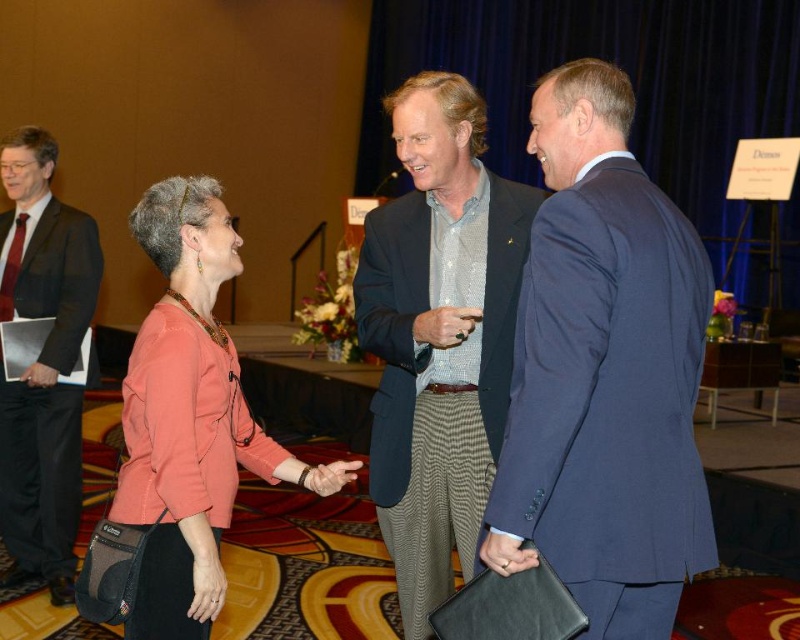
Who is positioned more to the right, textured wool blazer at center or dark gray suit at left?

From the viewer's perspective, textured wool blazer at center appears more on the right side.

I want to click on textured wool blazer at center, so click(438, 333).

The height and width of the screenshot is (640, 800). What are the coordinates of `textured wool blazer at center` in the screenshot? It's located at (438, 333).

Is blue suit at center positioned behind textured wool blazer at center?

No, it is not.

Does blue suit at center have a smaller size compared to textured wool blazer at center?

Indeed, blue suit at center has a smaller size compared to textured wool blazer at center.

Between point (534, 253) and point (394, 304), which one is positioned behind?

The point (394, 304) is behind.

You are a GUI agent. You are given a task and a screenshot of the screen. Output one action in this format:
    pyautogui.click(x=<x>, y=<y>)
    Task: Click on the blue suit at center
    
    Given the screenshot: What is the action you would take?
    pyautogui.click(x=604, y=372)

Looking at this image, is blue suit at center thinner than dark gray suit at left?

No, blue suit at center is not thinner than dark gray suit at left.

How distant is blue suit at center from dark gray suit at left?

blue suit at center and dark gray suit at left are 2.83 meters apart from each other.

Who is more forward, (640, 461) or (78, 468)?

Point (640, 461)

This screenshot has width=800, height=640. What are the coordinates of `blue suit at center` in the screenshot? It's located at (604, 372).